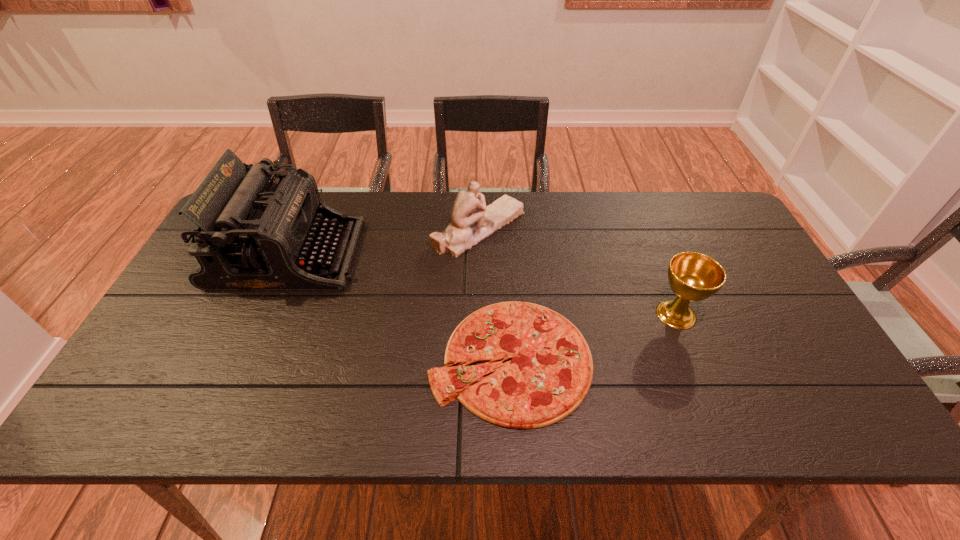
Locate an element on the screen. the tallest object is located at coordinates (250, 234).

Find the location of a particular element. This screenshot has height=540, width=960. the leftmost object is located at coordinates (250, 234).

Identify the location of figurine. (472, 221).

Identify the location of chalice. This screenshot has width=960, height=540. (692, 276).

The height and width of the screenshot is (540, 960). Identify the location of the shortest object. (550, 371).

Image resolution: width=960 pixels, height=540 pixels. Find the location of `vacant region located on the keyboard of the tallest object`. vacant region located on the keyboard of the tallest object is located at coordinates (455, 254).

The width and height of the screenshot is (960, 540). What are the coordinates of `vacant area situated 0.130m on the front-facing side of the figurine` in the screenshot? It's located at (567, 228).

The image size is (960, 540). I want to click on vacant region located on the right of the chalice, so pyautogui.click(x=774, y=314).

At what (x,y) coordinates should I click in order to perform the action: click on free region located on the right of the shortest object. Please return your answer as a coordinate pair (x, y). Image resolution: width=960 pixels, height=540 pixels. Looking at the image, I should click on (676, 359).

The width and height of the screenshot is (960, 540). What are the coordinates of `typewriter present at the far edge` in the screenshot? It's located at (250, 234).